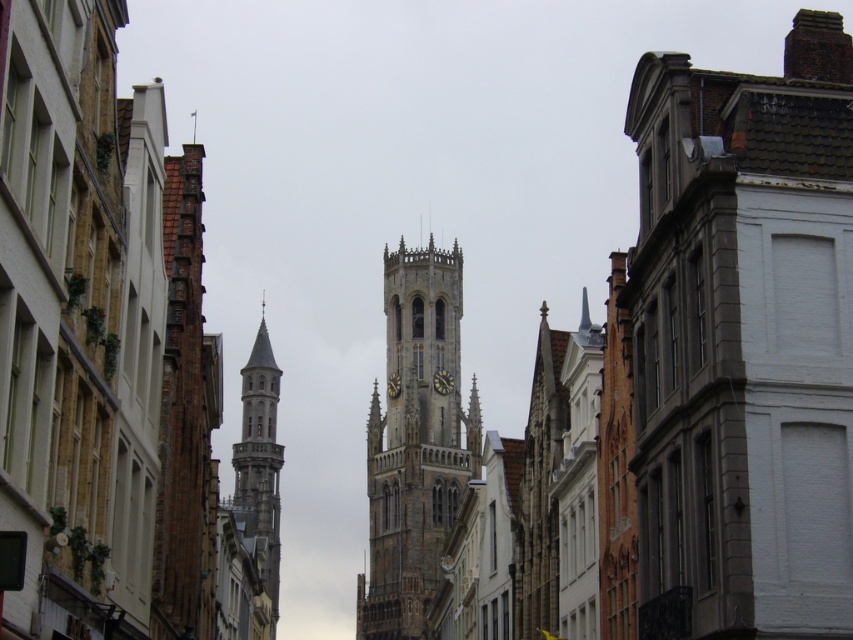
Is stone clock tower at center bigger than smooth stone tower at left?

No.

Is stone clock tower at center to the left of smooth stone tower at left from the viewer's perspective?

No, stone clock tower at center is not to the left of smooth stone tower at left.

The height and width of the screenshot is (640, 853). Identify the location of stone clock tower at center. (415, 442).

Locate an element on the screen. This screenshot has height=640, width=853. stone clock tower at center is located at coordinates (415, 442).

Which is behind, point (134, 300) or point (260, 442)?

The point (260, 442) is more distant.

The width and height of the screenshot is (853, 640). I want to click on stone tower at center, so click(108, 356).

The image size is (853, 640). What are the coordinates of `stone tower at center` in the screenshot? It's located at (108, 356).

Does stone tower at center have a greater width compared to stone clock tower at center?

Yes.

Find the location of a particular element. The width and height of the screenshot is (853, 640). stone tower at center is located at coordinates (108, 356).